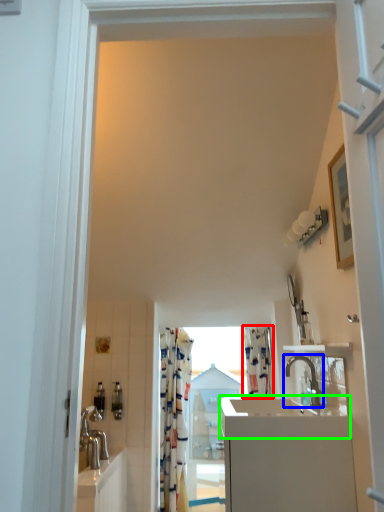
Question: Which object is positioned closest to shower curtain (highlighted by a red box)? Select from tap (highlighted by a blue box) and counter top (highlighted by a green box).

Choices:
 (A) tap
 (B) counter top

Answer: (A)